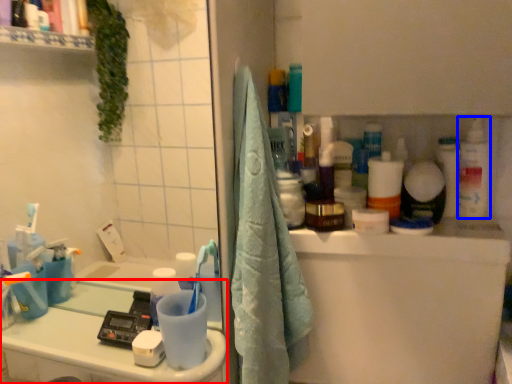
Question: Which point is closer to the camera, counter top (highlighted by a red box) or cleaning product (highlighted by a blue box)?

Choices:
 (A) counter top
 (B) cleaning product

Answer: (A)